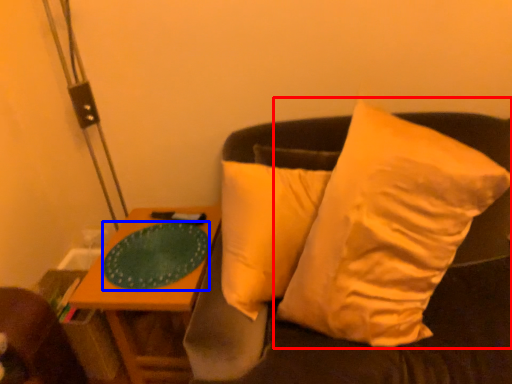
Question: Which object appears closest to the camera in this image, pillow (highlighted by a red box) or glass plate (highlighted by a blue box)?

Choices:
 (A) pillow
 (B) glass plate

Answer: (A)